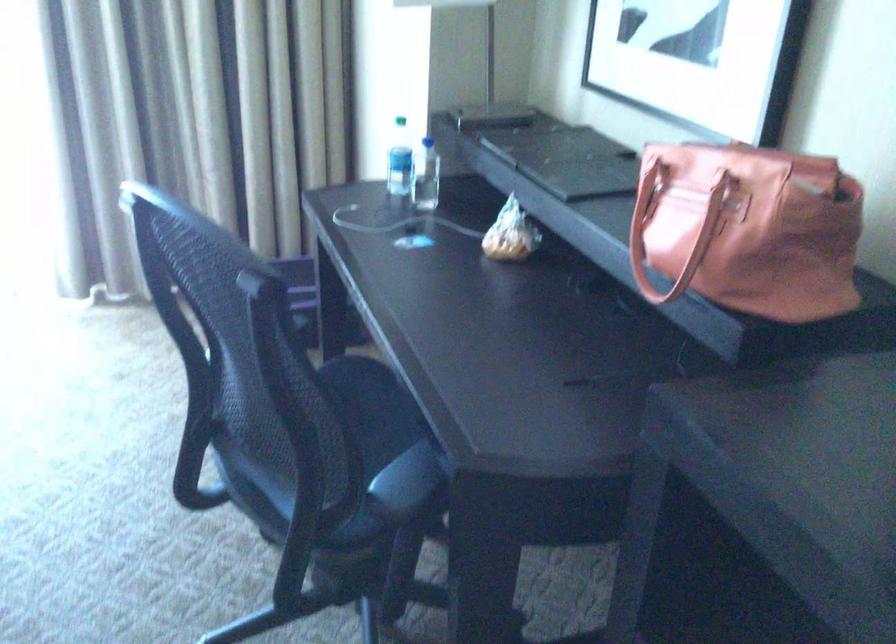
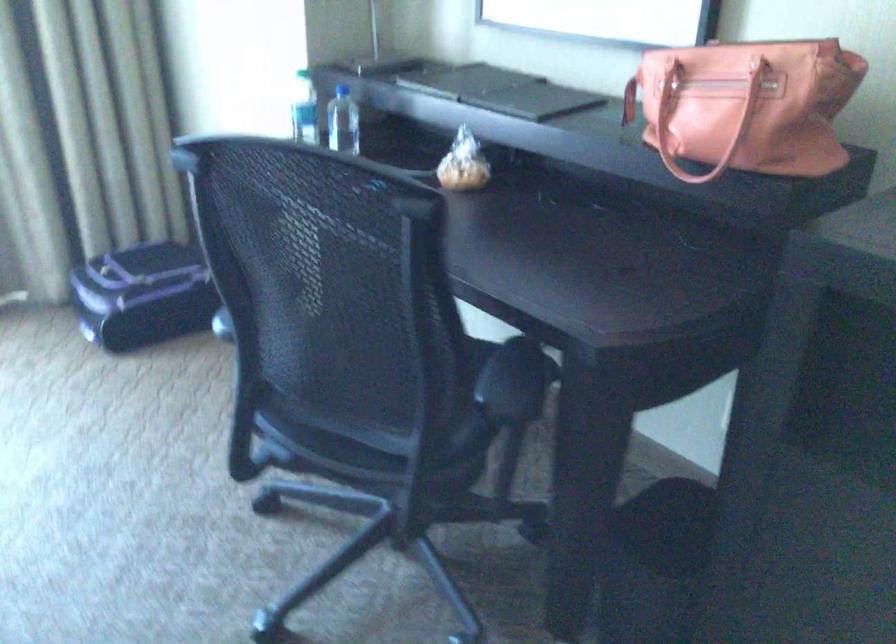
Find the pixel in the second image that matches point (645, 200) in the first image.

(629, 100)